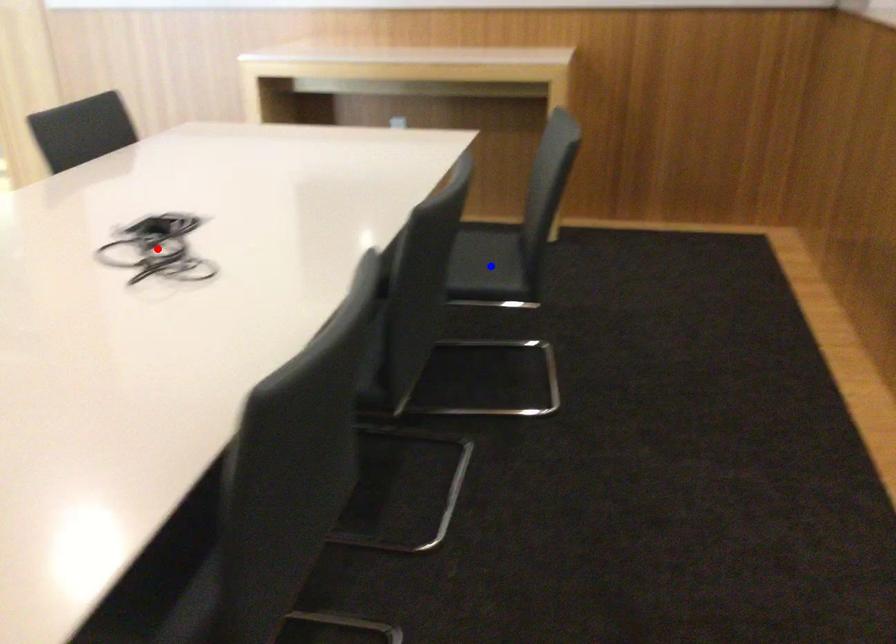
Question: In the image, two points are highlighted. Which point is nearer to the camera? Reply with the corresponding letter.

Choices:
 (A) blue point
 (B) red point

Answer: (B)